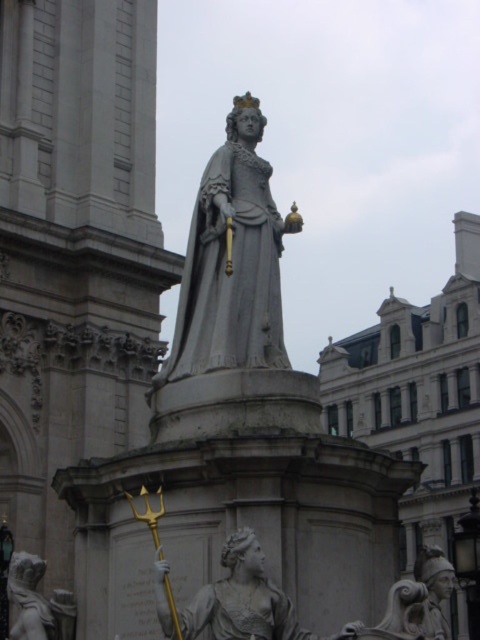
Between matte gray statue at center and white marble trident at lower left, which one is positioned higher?

Positioned higher is matte gray statue at center.

Is matte gray statue at center smaller than white marble trident at lower left?

Indeed, matte gray statue at center has a smaller size compared to white marble trident at lower left.

Measure the distance between point (304, 636) and camera.

Point (304, 636) is 101.66 feet from camera.

You are a GUI agent. You are given a task and a screenshot of the screen. Output one action in this format:
    pyautogui.click(x=<x>, y=<y>)
    Task: Click on the matte gray statue at center
    Image resolution: width=480 pixels, height=640 pixels.
    Given the screenshot: What is the action you would take?
    pyautogui.click(x=241, y=598)

Between gray stone statue at center and matte gray statue at center, which one has more height?

gray stone statue at center is taller.

Is point (197, 259) farther from viewer compared to point (243, 564)?

Yes, it is behind point (243, 564).

Which is in front, point (252, 257) or point (219, 600)?

Point (219, 600) is in front.

Identify the location of gray stone statue at center. (231, 260).

Who is positioned more to the right, gray stone statue at center or white marble trident at lower left?

From the viewer's perspective, gray stone statue at center appears more on the right side.

Is gray stone statue at center bigger than white marble trident at lower left?

Yes.

Which is in front, point (241, 264) or point (68, 605)?

Point (68, 605) is in front.

Locate an element on the screen. Image resolution: width=480 pixels, height=640 pixels. gray stone statue at center is located at coordinates (231, 260).